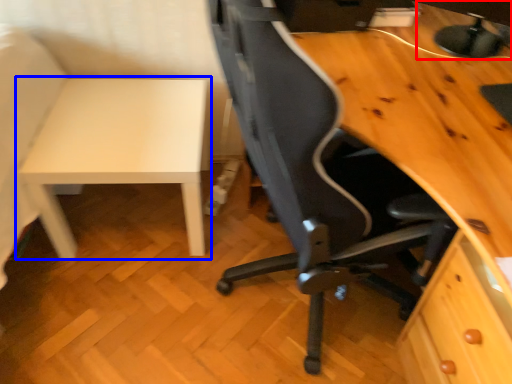
Question: Which object appears closest to the camera in this image, computer monitor (highlighted by a red box) or table (highlighted by a blue box)?

Choices:
 (A) computer monitor
 (B) table

Answer: (A)